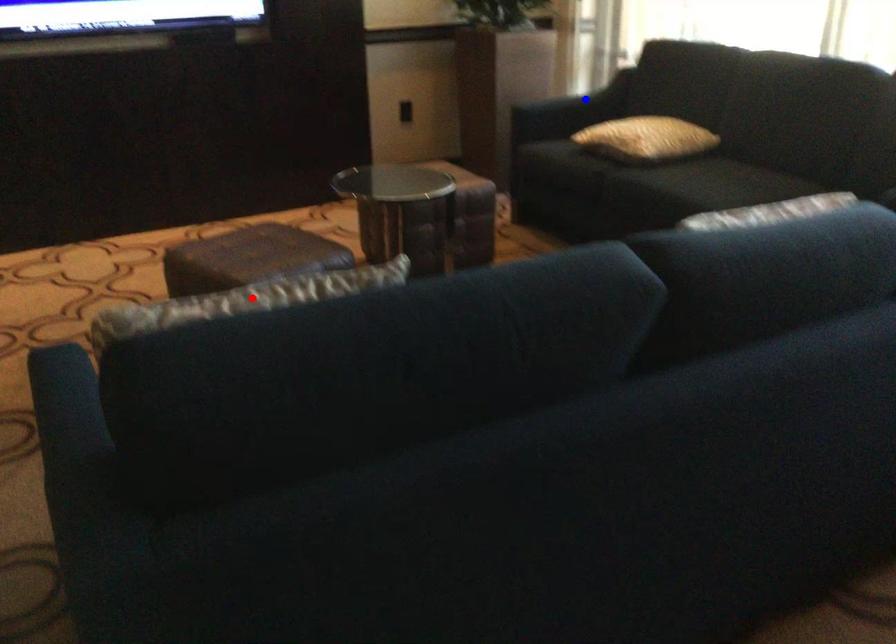
Question: In the image, two points are highlighted. Which point is nearer to the camera? Reply with the corresponding letter.

Choices:
 (A) blue point
 (B) red point

Answer: (B)